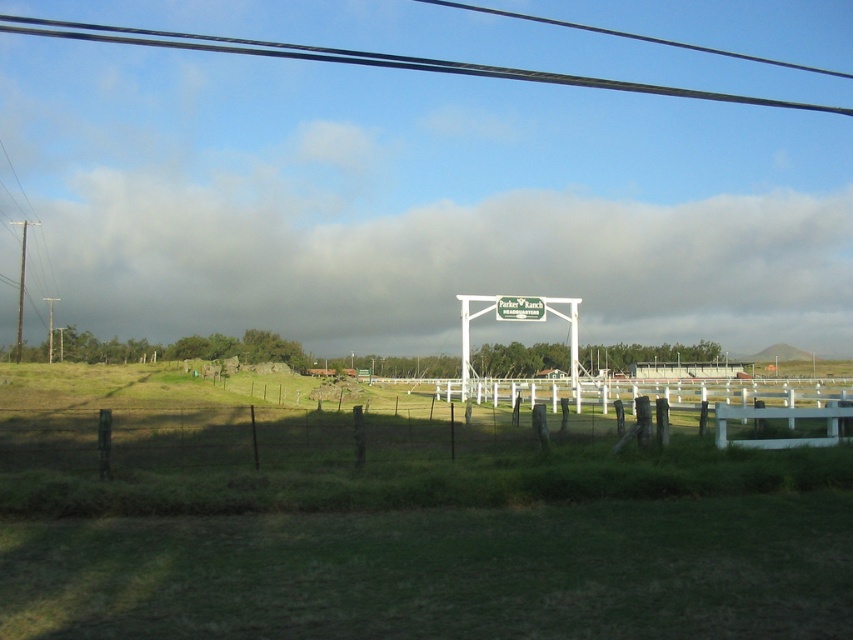
Question: Which object is the closest to the wooden fence at lower center?

Choices:
 (A) black wire at upper center
 (B) green plastic sign at center
 (C) cloudy sky at upper center

Answer: (B)

Question: Is cloudy sky at upper center smaller than green plastic sign at center?

Choices:
 (A) yes
 (B) no

Answer: (B)

Question: Can you confirm if cloudy sky at upper center is smaller than green plastic sign at center?

Choices:
 (A) no
 (B) yes

Answer: (A)

Question: Which of the following is the farthest from the observer?

Choices:
 (A) green plastic sign at center
 (B) cloudy sky at upper center

Answer: (B)

Question: Which point is farther to the camera?

Choices:
 (A) black wire at upper center
 (B) wooden fence at lower center
 (C) green plastic sign at center
 (D) cloudy sky at upper center

Answer: (A)

Question: Does cloudy sky at upper center come behind wooden fence at lower center?

Choices:
 (A) no
 (B) yes

Answer: (B)